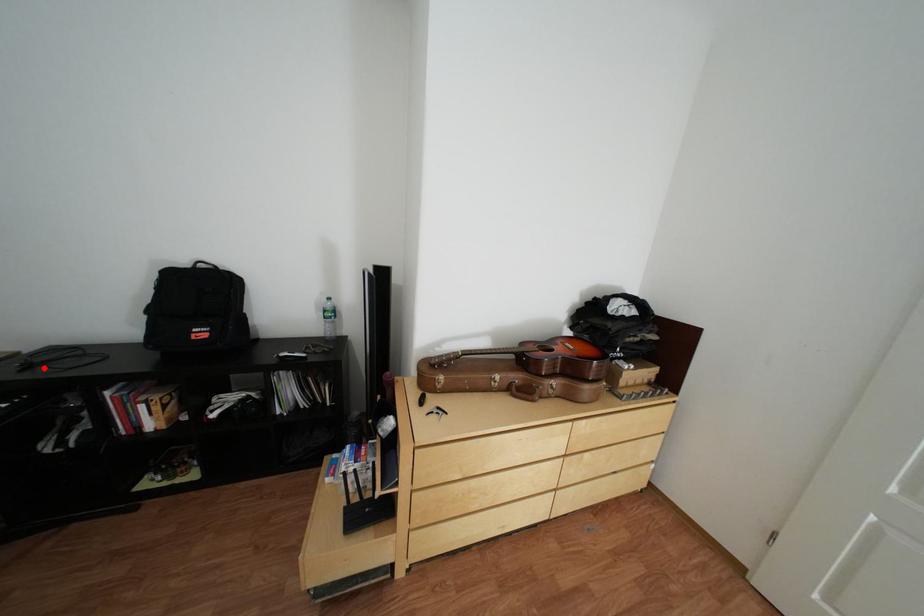
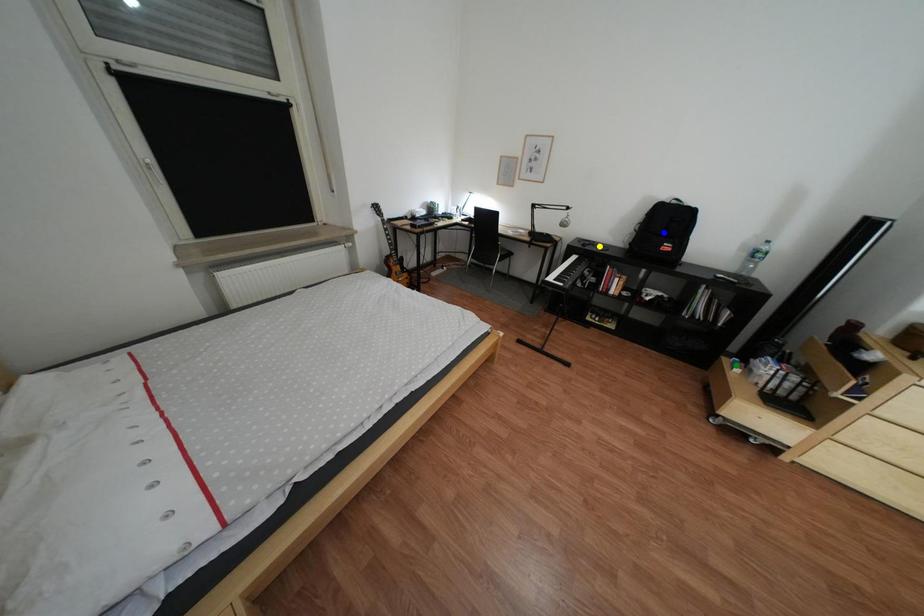
Question: I am providing you with two images of the same scene from different viewpoints. A red point is marked on the first image. You are given multiple points on the second image. Can you choose the point in image 2 that corresponds to the point in image 1?

Choices:
 (A) green point
 (B) yellow point
 (C) blue point

Answer: (B)